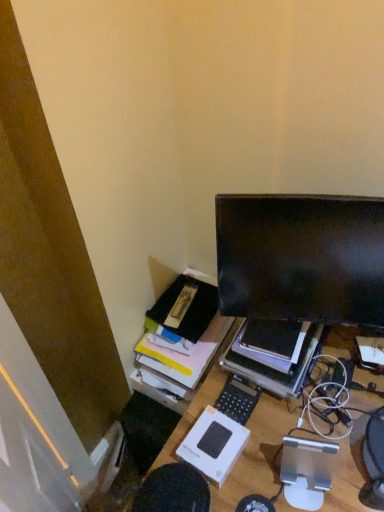
Question: Is point (236, 400) positioned closer to the camera than point (253, 378)?

Choices:
 (A) closer
 (B) farther

Answer: (A)

Question: In the image, is black plastic calculator at center on the left side or the right side of black matte monitor at upper right?

Choices:
 (A) right
 (B) left

Answer: (B)

Question: Estimate the real-world distances between objects in this image. Which object is farther from the wooden desk at center?

Choices:
 (A) matte black monitor at upper right
 (B) black plastic calculator at center
 (C) black matte monitor at upper right

Answer: (A)

Question: Based on their relative distances, which object is nearer to the wooden desk at center?

Choices:
 (A) black plastic calculator at center
 (B) black matte monitor at upper right
 (C) matte black monitor at upper right

Answer: (B)